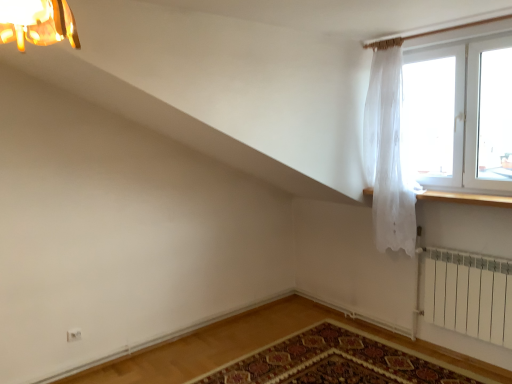
Question: Is transparent glass window at upper right placed right next to carpeted mat at lower center?

Choices:
 (A) no
 (B) yes

Answer: (A)

Question: Could you tell me if transparent glass window at upper right is facing carpeted mat at lower center?

Choices:
 (A) yes
 (B) no

Answer: (B)

Question: Is transparent glass window at upper right outside of carpeted mat at lower center?

Choices:
 (A) yes
 (B) no

Answer: (A)

Question: Can you confirm if transparent glass window at upper right is thinner than carpeted mat at lower center?

Choices:
 (A) yes
 (B) no

Answer: (A)

Question: Is transparent glass window at upper right bigger than carpeted mat at lower center?

Choices:
 (A) yes
 (B) no

Answer: (B)

Question: Do you think white sheer curtain at upper right is within carpeted mat at lower center, or outside of it?

Choices:
 (A) outside
 (B) inside

Answer: (A)

Question: Considering the positions of white sheer curtain at upper right and carpeted mat at lower center in the image, is white sheer curtain at upper right wider or thinner than carpeted mat at lower center?

Choices:
 (A) wide
 (B) thin

Answer: (B)

Question: Considering the positions of white sheer curtain at upper right and carpeted mat at lower center in the image, is white sheer curtain at upper right taller or shorter than carpeted mat at lower center?

Choices:
 (A) tall
 (B) short

Answer: (A)

Question: From the image's perspective, is white sheer curtain at upper right above or below carpeted mat at lower center?

Choices:
 (A) below
 (B) above

Answer: (B)

Question: In the image, is wooden at right on the left side or the right side of transparent glass window at upper right?

Choices:
 (A) left
 (B) right

Answer: (A)

Question: Considering the positions of wooden at right and transparent glass window at upper right in the image, is wooden at right wider or thinner than transparent glass window at upper right?

Choices:
 (A) wide
 (B) thin

Answer: (A)

Question: Considering the positions of point [455, 198] and point [459, 97], is point [455, 198] closer or farther from the camera than point [459, 97]?

Choices:
 (A) farther
 (B) closer

Answer: (A)

Question: Is wooden at right situated inside transparent glass window at upper right or outside?

Choices:
 (A) inside
 (B) outside

Answer: (B)

Question: Is carpeted mat at lower center inside or outside of transparent glass window at upper right?

Choices:
 (A) outside
 (B) inside

Answer: (A)

Question: Considering the positions of carpeted mat at lower center and transparent glass window at upper right in the image, is carpeted mat at lower center wider or thinner than transparent glass window at upper right?

Choices:
 (A) wide
 (B) thin

Answer: (A)